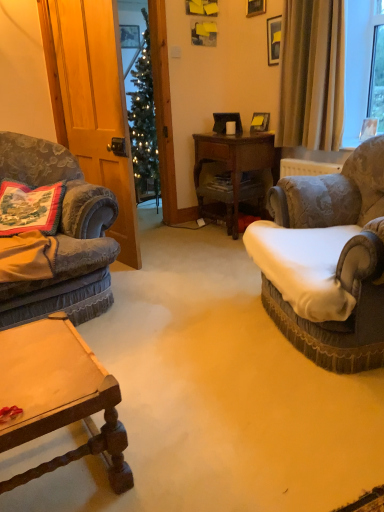
Question: Does wooden picture frame at upper center, the 2th picture frame when ordered from back to front, have a larger size compared to beige fabric curtain at upper right?

Choices:
 (A) no
 (B) yes

Answer: (A)

Question: Considering the relative sizes of wooden picture frame at upper center, which ranks as the first picture frame in front-to-back order, and beige fabric curtain at upper right in the image provided, is wooden picture frame at upper center, which ranks as the first picture frame in front-to-back order, shorter than beige fabric curtain at upper right?

Choices:
 (A) no
 (B) yes

Answer: (B)

Question: Is wooden picture frame at upper center, which ranks as the first picture frame in front-to-back order, at the left side of beige fabric curtain at upper right?

Choices:
 (A) yes
 (B) no

Answer: (A)

Question: Considering the relative sizes of wooden picture frame at upper center, positioned as the second picture frame in left-to-right order, and beige fabric curtain at upper right in the image provided, is wooden picture frame at upper center, positioned as the second picture frame in left-to-right order, taller than beige fabric curtain at upper right?

Choices:
 (A) yes
 (B) no

Answer: (B)

Question: From the image's perspective, is wooden picture frame at upper center, the 2th picture frame when ordered from back to front, on beige fabric curtain at upper right?

Choices:
 (A) yes
 (B) no

Answer: (A)

Question: Considering the positions of wooden picture frame at upper center, which is the 1th picture frame from right to left, and velvet-patterned armchair at right, arranged as the first chair when viewed from the right, in the image, is wooden picture frame at upper center, which is the 1th picture frame from right to left, taller or shorter than velvet-patterned armchair at right, arranged as the first chair when viewed from the right,?

Choices:
 (A) tall
 (B) short

Answer: (B)

Question: In the image, is wooden picture frame at upper center, positioned as the second picture frame in left-to-right order, on the left side or the right side of velvet-patterned armchair at right, which is the second chair from left to right?

Choices:
 (A) left
 (B) right

Answer: (A)

Question: From the image's perspective, is wooden picture frame at upper center, which is the 1th picture frame from right to left, above or below velvet-patterned armchair at right, which is the second chair from left to right?

Choices:
 (A) above
 (B) below

Answer: (A)

Question: Considering the positions of point (246, 6) and point (288, 180), is point (246, 6) closer or farther from the camera than point (288, 180)?

Choices:
 (A) farther
 (B) closer

Answer: (A)

Question: Is wooden desk at center to the left or to the right of beige fabric curtain at upper right in the image?

Choices:
 (A) left
 (B) right

Answer: (A)

Question: From a real-world perspective, is wooden desk at center above or below beige fabric curtain at upper right?

Choices:
 (A) above
 (B) below

Answer: (B)

Question: Is wooden desk at center wider or thinner than beige fabric curtain at upper right?

Choices:
 (A) wide
 (B) thin

Answer: (A)

Question: Choose the correct answer: Is wooden desk at center inside beige fabric curtain at upper right or outside it?

Choices:
 (A) inside
 (B) outside

Answer: (B)

Question: In terms of size, does velvet fabric armchair at left, which is counted as the 1th chair, starting from the left, appear bigger or smaller than matte white mug at center?

Choices:
 (A) big
 (B) small

Answer: (A)

Question: From the image's perspective, is velvet fabric armchair at left, which is counted as the 1th chair, starting from the left, positioned above or below matte white mug at center?

Choices:
 (A) above
 (B) below

Answer: (B)